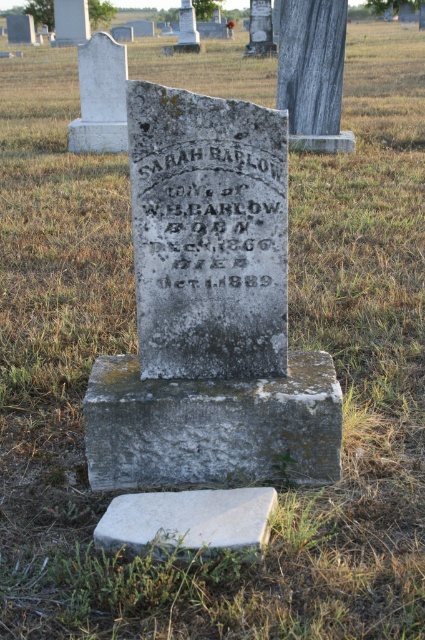
You are standing in a cemetery and see the gray stone base at center and the white stone slab at lower center. Which object is positioned higher relative to the other?

The gray stone base at center is located above the white stone slab at lower center, so it is positioned higher.